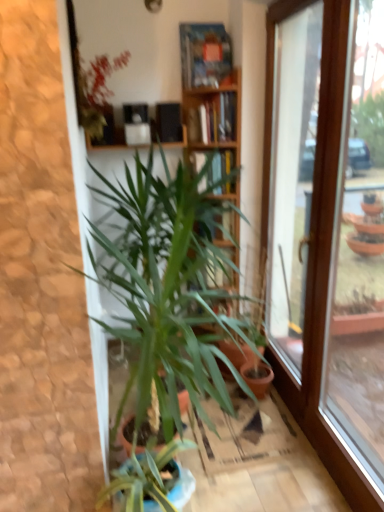
What is the approximate height of wooden bookcase at center?

wooden bookcase at center is 4.77 feet in height.

Measure the distance between point (217, 179) and camera.

A distance of 2.72 meters exists between point (217, 179) and camera.

Looking at this image, what is the approximate width of hardcover book at upper center?

hardcover book at upper center is 8.46 inches in width.

How much space does wooden bookshelf at center, marked as the second shelf in a left-to-right arrangement, occupy horizontally?

It is 8.53 inches.

This screenshot has width=384, height=512. In order to click on wooden bookcase at center in this screenshot , I will do `click(212, 104)`.

Is hardcover book at upper center to the right of transparent glass window at right from the viewer's perspective?

No, hardcover book at upper center is not to the right of transparent glass window at right.

How far apart are hardcover book at upper center and transparent glass window at right?

22.28 inches.

What's the angular difference between hardcover book at upper center and transparent glass window at right's facing directions?

The angular difference between hardcover book at upper center and transparent glass window at right is 89.9 degrees.

Which of these two, hardcover book at upper center or transparent glass window at right, is thinner?

transparent glass window at right.

Is green leafy plant at center, arranged as the 2th houseplant when viewed from the top, positioned in front of transparent glass window at right?

No, the depth of green leafy plant at center, arranged as the 2th houseplant when viewed from the top, is greater than that of transparent glass window at right.

Is green leafy plant at center, arranged as the 2th houseplant when viewed from the top, not close to transparent glass window at right?

They are positioned close to each other.

Is green leafy plant at center, arranged as the 2th houseplant when viewed from the top, bigger than transparent glass window at right?

Correct, green leafy plant at center, arranged as the 2th houseplant when viewed from the top, is larger in size than transparent glass window at right.

Considering the sizes of objects green leafy plant at center, which is the 1th houseplant in bottom-to-top order, and transparent glass window at right in the image provided, who is wider, green leafy plant at center, which is the 1th houseplant in bottom-to-top order, or transparent glass window at right?

green leafy plant at center, which is the 1th houseplant in bottom-to-top order.

Can you confirm if transparent glass window at right is taller than matte black speakers at upper center, arranged as the 2th shelf when viewed from the right?

Indeed, transparent glass window at right has a greater height compared to matte black speakers at upper center, arranged as the 2th shelf when viewed from the right.

Looking at this image, is transparent glass window at right positioned with its back to matte black speakers at upper center, which is counted as the first shelf, starting from the left?

No, matte black speakers at upper center, which is counted as the first shelf, starting from the left, is not at the back of transparent glass window at right.

Consider the image. Measure the distance from transparent glass window at right to matte black speakers at upper center, arranged as the 2th shelf when viewed from the right.

35.51 inches.

Does transparent glass window at right have a larger size compared to matte black speakers at upper center, which is counted as the first shelf, starting from the left?

Yes.

Which is more to the right, transparent glass window at right or matte black speakers at upper center, which is counted as the first shelf, starting from the left?

Positioned to the right is transparent glass window at right.

Does transparent glass window at right have a lesser width compared to matte black speakers at upper center, arranged as the 2th shelf when viewed from the right?

Yes, transparent glass window at right is thinner than matte black speakers at upper center, arranged as the 2th shelf when viewed from the right.

Considering the sizes of objects transparent glass window at right and matte black speakers at upper center, which is counted as the first shelf, starting from the left, in the image provided, who is bigger, transparent glass window at right or matte black speakers at upper center, which is counted as the first shelf, starting from the left,?

With larger size is transparent glass window at right.

From the image's perspective, count 2nd shelfs upward from the wooden bookcase at center and point to it. Please provide its 2D coordinates.

[(108, 144)]

Which is further, (x=96, y=147) or (x=184, y=55)?

The point (x=184, y=55) is more distant.

Based on their sizes in the image, would you say matte black speakers at upper center, which is counted as the first shelf, starting from the left, is bigger or smaller than wooden bookcase at center?

In the image, matte black speakers at upper center, which is counted as the first shelf, starting from the left, appears to be smaller than wooden bookcase at center.

Which object is positioned more to the left, matte black speakers at upper center, which is counted as the first shelf, starting from the left, or wooden bookcase at center?

matte black speakers at upper center, which is counted as the first shelf, starting from the left.

From a real-world perspective, is wooden bookcase at center located higher than transparent glass window at right?

Yes, from a real-world perspective, wooden bookcase at center is on top of transparent glass window at right.

Is wooden bookcase at center in front of transparent glass window at right?

No.

Considering the sizes of objects wooden bookcase at center and transparent glass window at right in the image provided, who is taller, wooden bookcase at center or transparent glass window at right?

With more height is transparent glass window at right.

Does point (208, 184) come behind point (334, 104)?

That is True.

I want to click on houseplant in front of the transparent glass window at right, so point(97,95).

Is transparent glass window at right not close to green leafy plant at upper left, which is the 2th houseplant from bottom to top?

Yes, transparent glass window at right is far from green leafy plant at upper left, which is the 2th houseplant from bottom to top.

Is green leafy plant at upper left, which is the 2th houseplant from bottom to top, inside transparent glass window at right?

No, green leafy plant at upper left, which is the 2th houseplant from bottom to top, is not surrounded by transparent glass window at right.

Which object is wider, transparent glass window at right or green leafy plant at upper left, which is the 2th houseplant from bottom to top?

green leafy plant at upper left, which is the 2th houseplant from bottom to top.

In the image, there is a hardcover book at upper center. Identify the location of window screen below it (from the image's perspective). This screenshot has width=384, height=512. (291, 174).

Where is `houseplant behind the transparent glass window at right`? houseplant behind the transparent glass window at right is located at coordinates (167, 290).

Considering their positions, is wooden bookcase at center positioned closer to transparent glass window at right than green leafy plant at center, which is the 1th houseplant in bottom-to-top order?

Among the two, wooden bookcase at center is located nearer to transparent glass window at right.

Considering their positions, is transparent glass window at right positioned further to hardcover book at upper center than green leafy plant at upper left, placed as the 1th houseplant when sorted from top to bottom?

Among the two, transparent glass window at right is located further to hardcover book at upper center.

Based on their spatial positions, is transparent glass window at right or matte black speakers at upper center, arranged as the 2th shelf when viewed from the right, closer to transparent glass window at right?

transparent glass window at right is closer to transparent glass window at right.

Estimate the real-world distances between objects in this image. Which object is further from green leafy plant at upper left, which is the 2th houseplant from bottom to top, green leafy plant at center, arranged as the 2th houseplant when viewed from the top, or matte black speakers at upper center, arranged as the 2th shelf when viewed from the right?

green leafy plant at center, arranged as the 2th houseplant when viewed from the top, is further to green leafy plant at upper left, which is the 2th houseplant from bottom to top.

Considering their positions, is wooden bookshelf at center, placed as the 1th shelf when sorted from right to left, positioned further to transparent glass window at right than green leafy plant at center, which is the 1th houseplant in bottom-to-top order?

green leafy plant at center, which is the 1th houseplant in bottom-to-top order.

Consider the image. Considering their positions, is hardcover book at upper center positioned further to wooden bookshelf at center, marked as the second shelf in a left-to-right arrangement, than wooden bookcase at center?

wooden bookcase at center lies further to wooden bookshelf at center, marked as the second shelf in a left-to-right arrangement, than the other object.

When comparing their distances from wooden bookshelf at center, placed as the 1th shelf when sorted from right to left, does transparent glass window at right or hardcover book at upper center seem further?

transparent glass window at right.

Estimate the real-world distances between objects in this image. Which object is closer to hardcover book at upper center, green leafy plant at upper left, which is the 2th houseplant from bottom to top, or matte black speakers at upper center, arranged as the 2th shelf when viewed from the right?

matte black speakers at upper center, arranged as the 2th shelf when viewed from the right.

Image resolution: width=384 pixels, height=512 pixels. Identify the location of bookcase located between transparent glass window at right and hardcover book at upper center in the depth direction. (212, 104).

Identify the location of book between transparent glass window at right and wooden bookshelf at center, marked as the second shelf in a left-to-right arrangement, in the front-back direction. Image resolution: width=384 pixels, height=512 pixels. (213, 118).

Image resolution: width=384 pixels, height=512 pixels. In order to click on window screen between transparent glass window at right and green leafy plant at center, which is the 1th houseplant in bottom-to-top order, from front to back in this screenshot , I will do `click(291, 174)`.

Find the location of `window screen between transparent glass window at right and matte black speakers at upper center, arranged as the 2th shelf when viewed from the right, along the z-axis`. window screen between transparent glass window at right and matte black speakers at upper center, arranged as the 2th shelf when viewed from the right, along the z-axis is located at coordinates (291, 174).